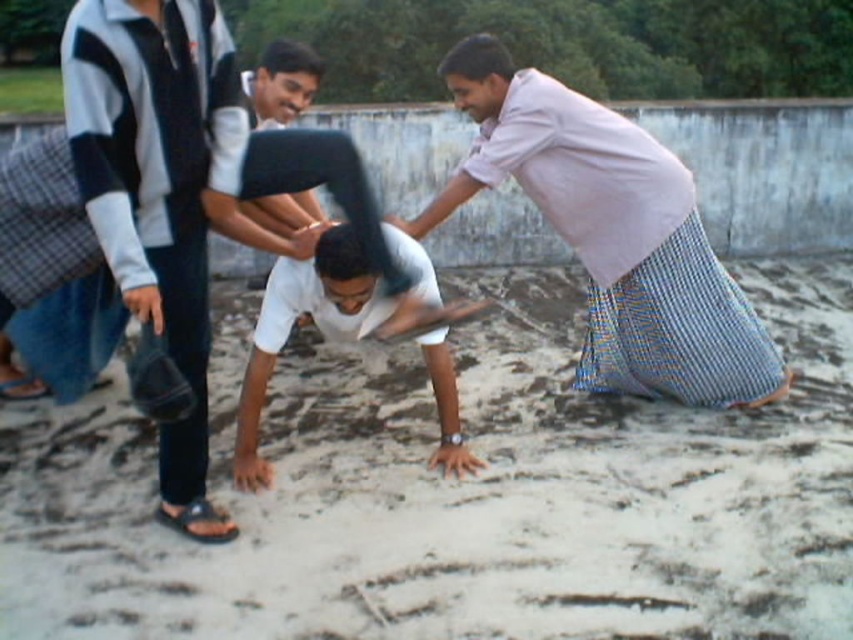
Who is taller, white sandy ground at center or blue woven cloth at right?

white sandy ground at center is taller.

Which of these two, white sandy ground at center or blue woven cloth at right, stands shorter?

blue woven cloth at right

You are a GUI agent. You are given a task and a screenshot of the screen. Output one action in this format:
    pyautogui.click(x=<x>, y=<y>)
    Task: Click on the white sandy ground at center
    The width and height of the screenshot is (853, 640).
    Given the screenshot: What is the action you would take?
    pyautogui.click(x=457, y=493)

Between point (699, 257) and point (665, 362), which one is positioned in front?

Point (699, 257)

Consider the image. Between light pink woven cloth at upper right and blue woven cloth at right, which one is positioned lower?

blue woven cloth at right is lower down.

Consider the image. Measure the distance between light pink woven cloth at upper right and camera.

light pink woven cloth at upper right and camera are 12.00 feet apart from each other.

Find the location of a particular element. The width and height of the screenshot is (853, 640). light pink woven cloth at upper right is located at coordinates (611, 234).

Which is below, white sandy ground at center or white matte shirt at center?

→ white sandy ground at center is below.

Can you confirm if white sandy ground at center is thinner than white matte shirt at center?

In fact, white sandy ground at center might be wider than white matte shirt at center.

Who is more forward, (x=654, y=620) or (x=312, y=301)?

Point (x=654, y=620)

At what (x,y) coordinates should I click in order to perform the action: click on white sandy ground at center. Please return your answer as a coordinate pair (x, y). Looking at the image, I should click on (457, 493).